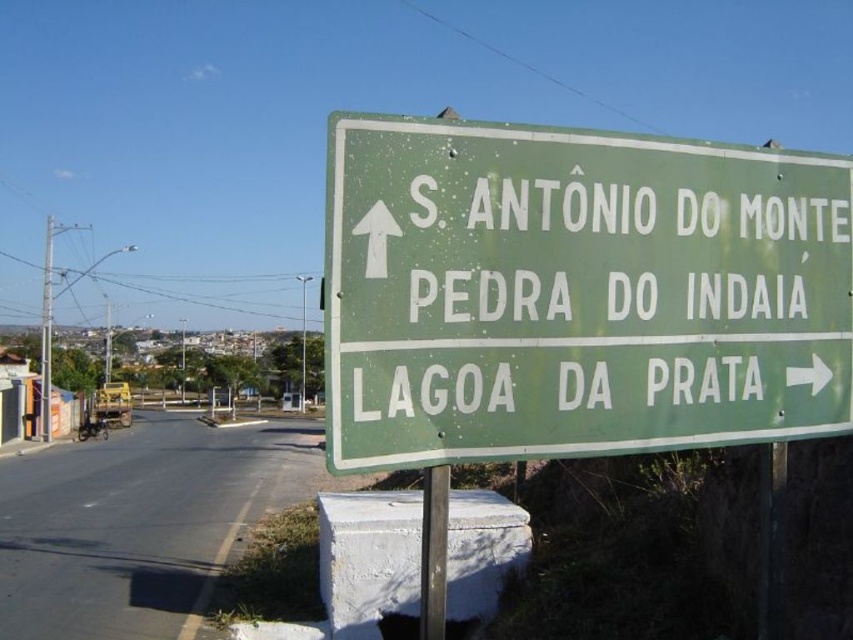
Question: Is the position of green matte sign at upper right more distant than that of metallic pole at center?

Choices:
 (A) yes
 (B) no

Answer: (B)

Question: Is green matte sign at upper right to the left of metallic pole at center from the viewer's perspective?

Choices:
 (A) yes
 (B) no

Answer: (B)

Question: Which of the following is the closest to the observer?

Choices:
 (A) (363, 269)
 (B) (445, 524)

Answer: (A)

Question: Is green matte sign at upper right closer to camera compared to metallic pole at center?

Choices:
 (A) yes
 (B) no

Answer: (A)